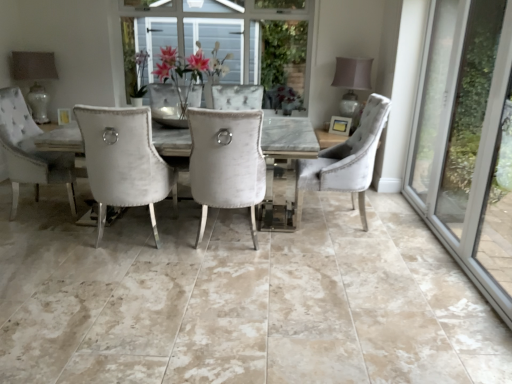
The height and width of the screenshot is (384, 512). Identify the location of vacant area on the back side of velvet grey chair at right, the second chair in the left-to-right sequence. (329, 201).